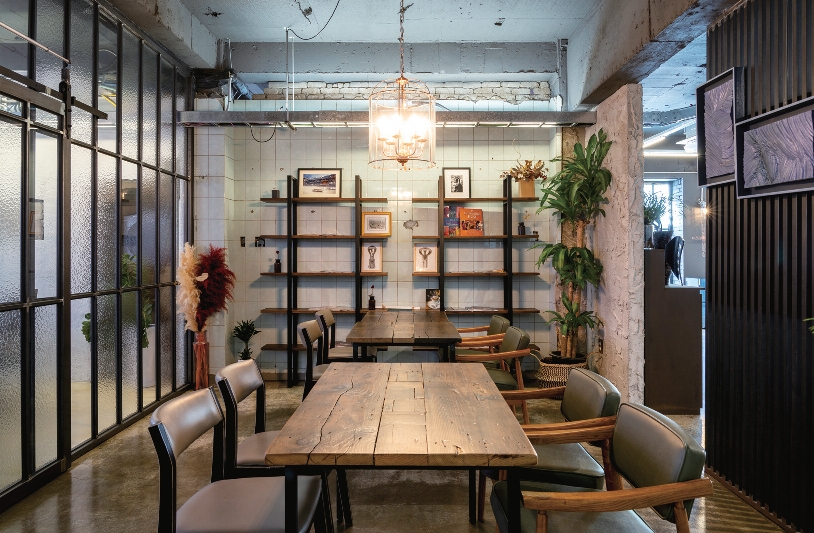
The image size is (814, 533). Identify the location of places to sit. (338, 349), (318, 368), (254, 444), (493, 325), (513, 338), (588, 394), (646, 442).